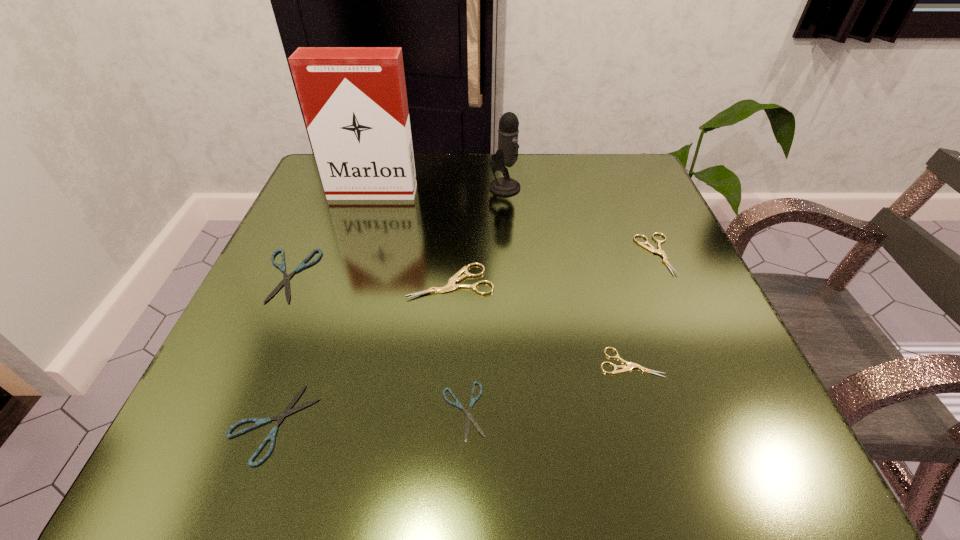
Locate an element on the screen. vacant space that satisfies the following two spatial constraints: 1. on the front-facing side of the sixth shortest object; 2. on the right side of the cigarette_case is located at coordinates (345, 282).

The height and width of the screenshot is (540, 960). In order to click on free point that satisfies the following two spatial constraints: 1. on the front-facing side of the cigarette_case; 2. on the left side of the shortest shears in this screenshot , I will do `click(304, 410)`.